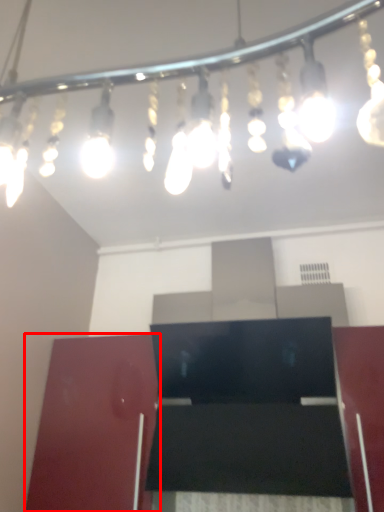
Question: From the image, what is the correct spatial relationship of furniture (annotated by the red box) in relation to lamp?

Choices:
 (A) right
 (B) left

Answer: (B)